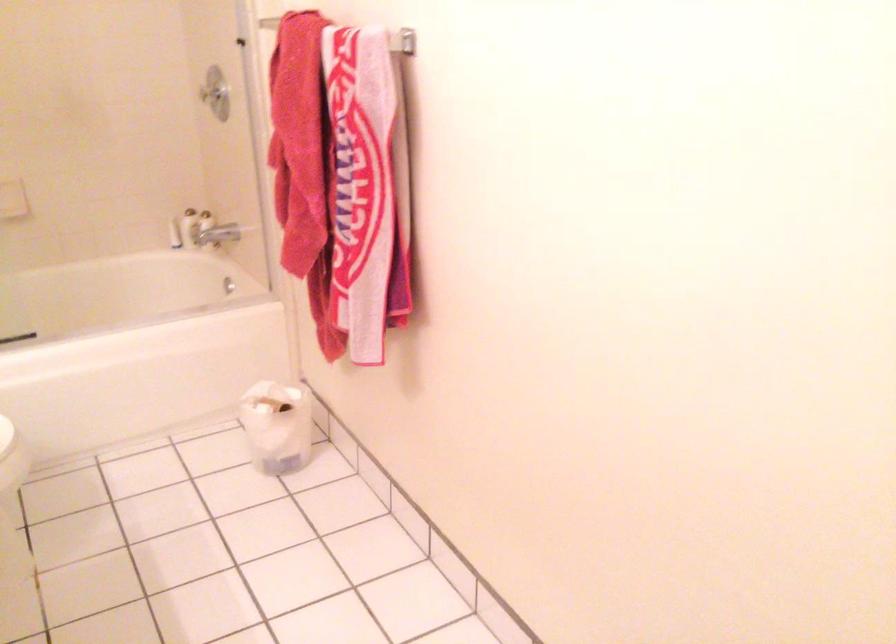
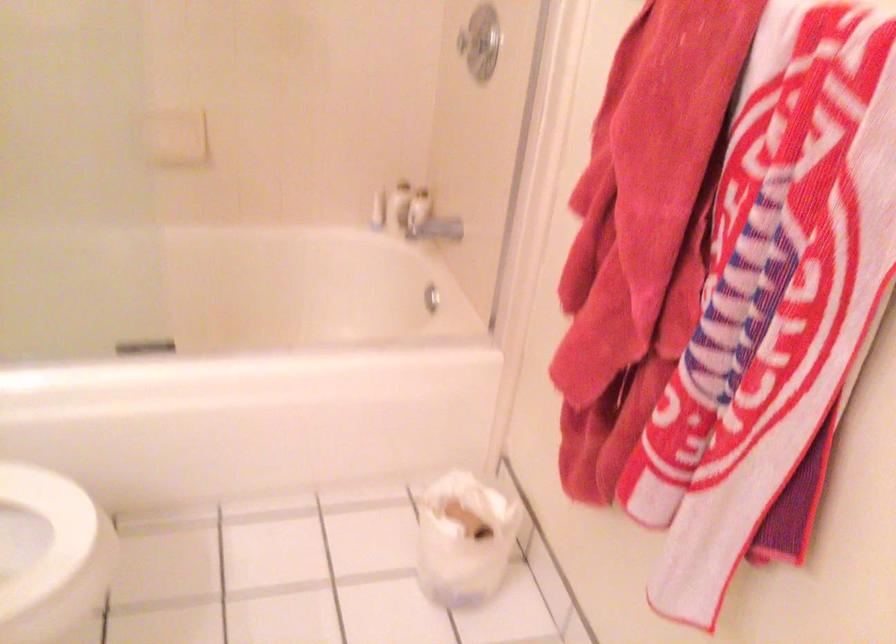
Locate, in the second image, the point that corresponds to pixel 218 234 in the first image.

(429, 221)